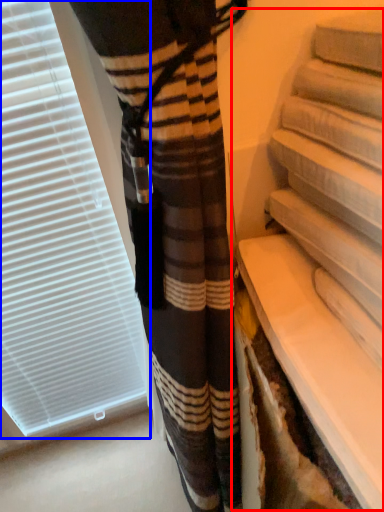
Question: Which point is further to the camera, shelf (highlighted by a red box) or window blind (highlighted by a blue box)?

Choices:
 (A) shelf
 (B) window blind

Answer: (B)